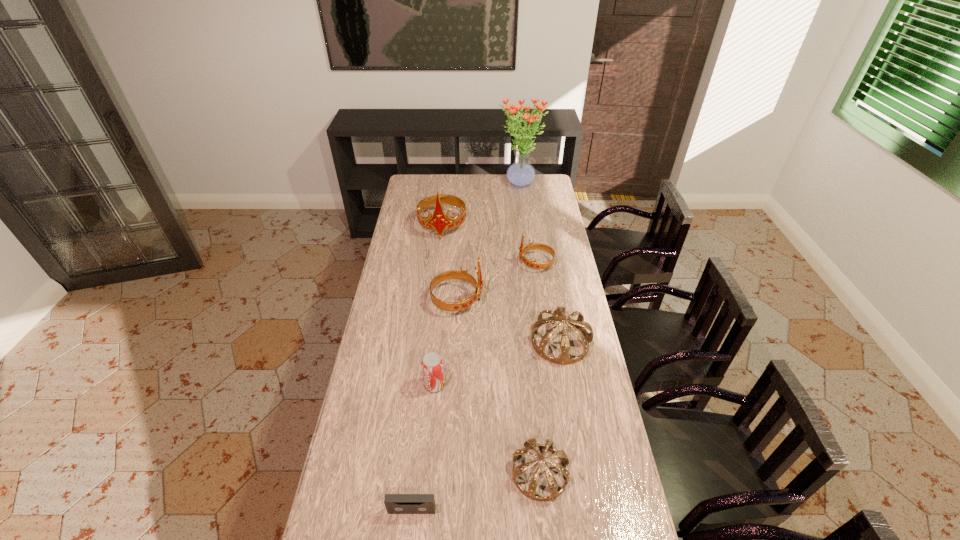
Where is `unoccupied area between the rightmost red tiara and the second tallest object`? unoccupied area between the rightmost red tiara and the second tallest object is located at coordinates (489, 245).

This screenshot has height=540, width=960. In order to click on vacant region between the shortest tiara and the red flower arrangement in this screenshot , I will do `click(530, 329)`.

The image size is (960, 540). I want to click on object that is the seventh nearest to the flower arrangement, so click(x=395, y=503).

The height and width of the screenshot is (540, 960). What are the coordinates of `object that stands as the fourth closest to the second nearest red tiara` in the screenshot? It's located at (520, 174).

Select which tiara appears as the third closest to the flower arrangement. Please provide its 2D coordinates. Your answer should be formatted as a tuple, i.e. [(x, y)], where the tuple contains the x and y coordinates of a point satisfying the conditions above.

[(462, 275)]

Locate an element on the screen. The height and width of the screenshot is (540, 960). tiara that is the fourth closest to the shortest object is located at coordinates (531, 246).

This screenshot has height=540, width=960. What are the coordinates of `red tiara that stands as the second closest to the tallest tiara` in the screenshot? It's located at point(462,275).

Find the location of a particular element. red tiara that is the closest to the seventh tallest object is located at coordinates (462, 275).

The width and height of the screenshot is (960, 540). In order to click on vacant space that satisfies the following two spatial constraints: 1. on the front-facing side of the second tallest tiara; 2. on the front-facing side of the videotape in this screenshot , I will do `click(446, 510)`.

You are a GUI agent. You are given a task and a screenshot of the screen. Output one action in this format:
    pyautogui.click(x=<x>, y=<y>)
    Task: Click on the vacant space that satisfies the following two spatial constraints: 1. on the logo side of the soda can; 2. on the right side of the nearer brown tiara
    The height and width of the screenshot is (540, 960).
    Given the screenshot: What is the action you would take?
    426,473